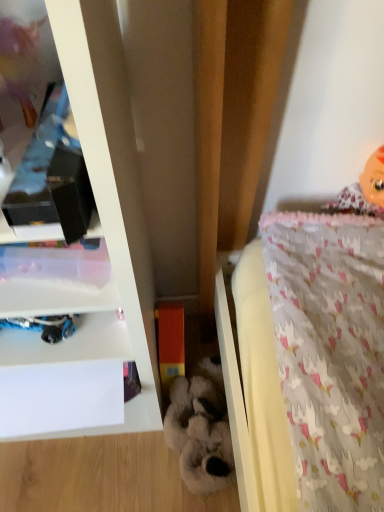
Question: Considering the relative positions of white glossy shelf at upper left and fluffy white stuffed animal at center, which ranks as the 2th toy in left-to-right order, in the image provided, is white glossy shelf at upper left in front of fluffy white stuffed animal at center, which ranks as the 2th toy in left-to-right order,?

Choices:
 (A) yes
 (B) no

Answer: (A)

Question: Is white glossy shelf at upper left outside fluffy white stuffed animal at center, which is the first toy from right to left?

Choices:
 (A) yes
 (B) no

Answer: (A)

Question: Is white glossy shelf at upper left aimed at fluffy white stuffed animal at center, which ranks as the 2th toy in left-to-right order?

Choices:
 (A) yes
 (B) no

Answer: (B)

Question: From the image's perspective, is white glossy shelf at upper left on top of fluffy white stuffed animal at center, which is the first toy from right to left?

Choices:
 (A) no
 (B) yes

Answer: (B)

Question: Is white glossy shelf at upper left turned away from fluffy white stuffed animal at center, which ranks as the 2th toy in left-to-right order?

Choices:
 (A) yes
 (B) no

Answer: (B)

Question: From a real-world perspective, is white glossy shelf at upper left on fluffy white stuffed animal at center, which ranks as the 2th toy in left-to-right order?

Choices:
 (A) no
 (B) yes

Answer: (B)

Question: Is orange matte block at center, which is the 2th toy from right to left, inside fluffy white stuffed animal at center, which ranks as the 2th toy in left-to-right order?

Choices:
 (A) yes
 (B) no

Answer: (B)

Question: Can you confirm if fluffy white stuffed animal at center, which is the first toy from right to left, is smaller than orange matte block at center, which appears as the 1th toy when viewed from the left?

Choices:
 (A) no
 (B) yes

Answer: (A)

Question: From the image's perspective, is fluffy white stuffed animal at center, which ranks as the 2th toy in left-to-right order, below orange matte block at center, which is the 2th toy from right to left?

Choices:
 (A) yes
 (B) no

Answer: (A)

Question: Is fluffy white stuffed animal at center, which ranks as the 2th toy in left-to-right order, closer to the viewer compared to orange matte block at center, which is the 2th toy from right to left?

Choices:
 (A) no
 (B) yes

Answer: (B)

Question: From a real-world perspective, is fluffy white stuffed animal at center, which is the first toy from right to left, below orange matte block at center, which appears as the 1th toy when viewed from the left?

Choices:
 (A) no
 (B) yes

Answer: (B)

Question: Is fluffy white stuffed animal at center, which is the first toy from right to left, bigger than orange matte block at center, which appears as the 1th toy when viewed from the left?

Choices:
 (A) yes
 (B) no

Answer: (A)

Question: Considering the relative sizes of pink fabric doll at upper right and orange matte block at center, which is the 2th toy from right to left, in the image provided, is pink fabric doll at upper right smaller than orange matte block at center, which is the 2th toy from right to left,?

Choices:
 (A) no
 (B) yes

Answer: (A)